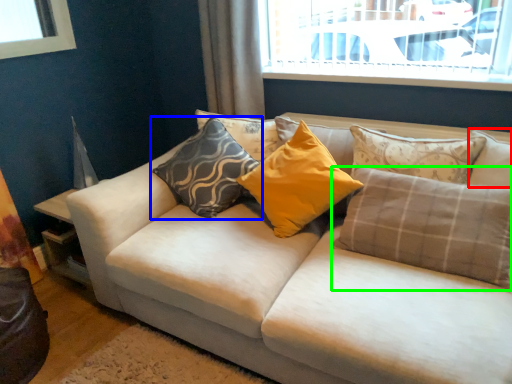
Question: Estimate the real-world distances between objects in this image. Which object is closer to pillow (highlighted by a red box), pillow (highlighted by a blue box) or pillow (highlighted by a green box)?

Choices:
 (A) pillow
 (B) pillow

Answer: (B)